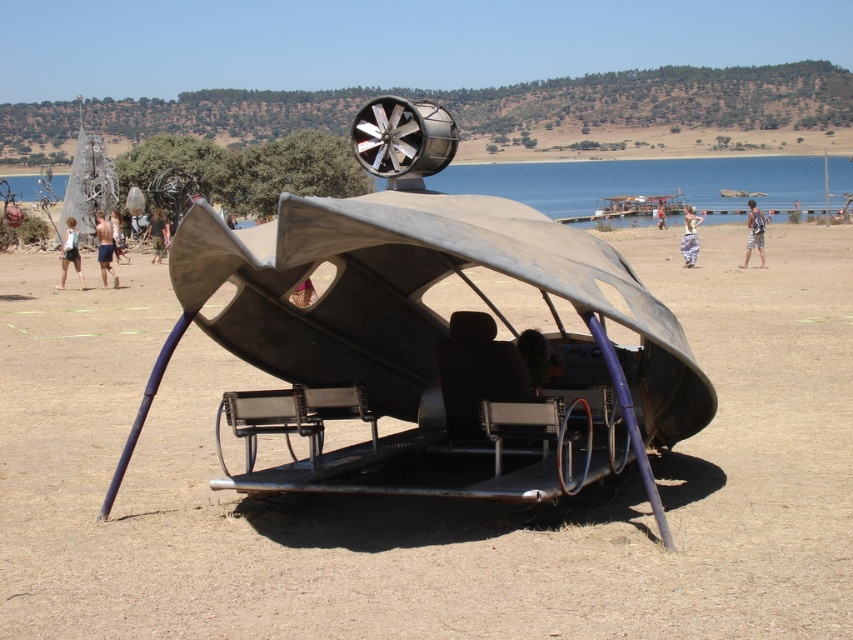
Question: Can you confirm if skinny man at left is positioned above light blue denim shorts at lower left?

Choices:
 (A) yes
 (B) no

Answer: (A)

Question: Considering the real-world distances, which object is closest to the white cotton pants at center?

Choices:
 (A) tan skin human at center
 (B) skinny man at left
 (C) brown dirt field at center
 (D) camouflage fabric person at center

Answer: (A)

Question: Is tan skin human at center bigger than white fabric dress at center?

Choices:
 (A) no
 (B) yes

Answer: (B)

Question: Can you confirm if tan skin human at center is positioned above camouflage fabric person at center?

Choices:
 (A) yes
 (B) no

Answer: (B)

Question: Based on their relative distances, which object is farther from the white fabric dress at center?

Choices:
 (A) skinny man at left
 (B) white cotton shorts at lower left
 (C) light blue denim shorts at lower left
 (D) tan skin human at center

Answer: (B)

Question: Among these objects, which one is nearest to the camera?

Choices:
 (A) light blue denim shorts at lower left
 (B) camouflage fabric person at center
 (C) brown dirt field at center

Answer: (C)